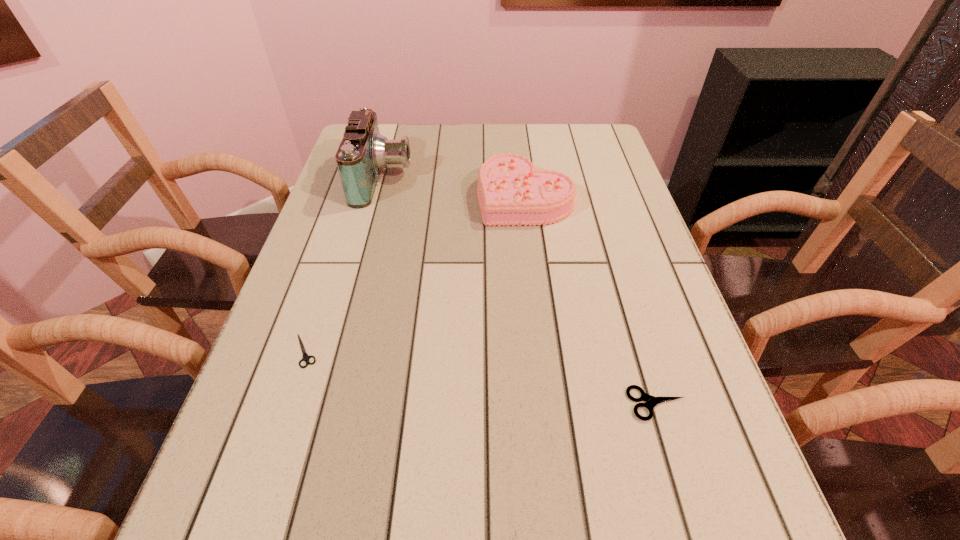
What are the coordinates of `free region at the near left corner of the desktop` in the screenshot? It's located at (269, 536).

Identify the location of empty space between the camcorder and the third shortest object. This screenshot has width=960, height=540. (454, 188).

Identify the location of vacant area between the camcorder and the cake. This screenshot has width=960, height=540. (454, 188).

Locate an element on the screen. The width and height of the screenshot is (960, 540). unoccupied position between the right shears and the second object from right to left is located at coordinates (590, 300).

Where is `blank region between the tallest object and the third shortest object`? blank region between the tallest object and the third shortest object is located at coordinates (454, 188).

At what (x,y) coordinates should I click in order to perform the action: click on vacant point located between the tallest object and the right shears. Please return your answer as a coordinate pair (x, y). Image resolution: width=960 pixels, height=540 pixels. Looking at the image, I should click on (520, 292).

Where is `free area in between the cake and the nearest object`? This screenshot has width=960, height=540. free area in between the cake and the nearest object is located at coordinates (590, 300).

Identify the location of free spot between the third object from left to right and the left shears. The width and height of the screenshot is (960, 540). (415, 274).

Identify the location of free space between the right shears and the second nearest object. The height and width of the screenshot is (540, 960). (481, 377).

Find the location of a particular element. Image resolution: width=960 pixels, height=540 pixels. vacant area that lies between the camcorder and the third shortest object is located at coordinates (454, 188).